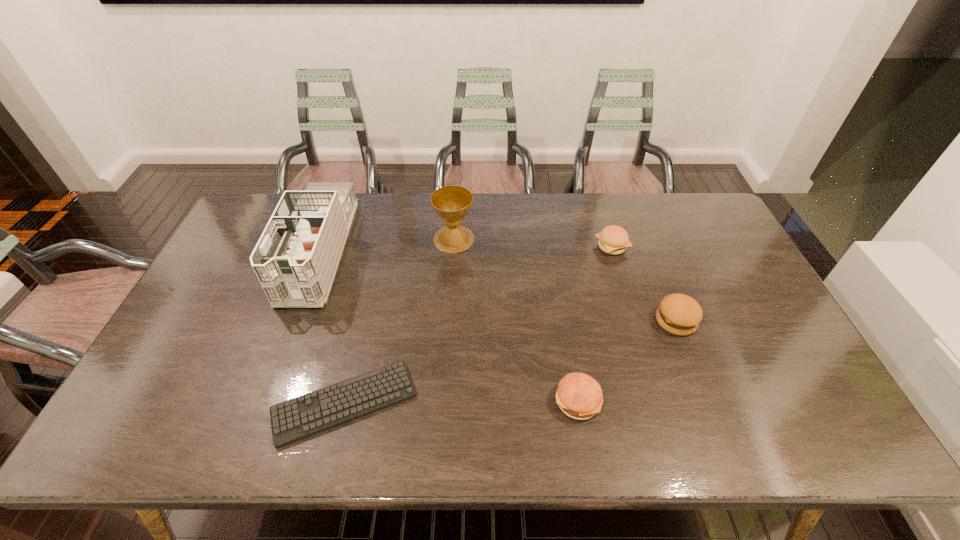
I want to click on dollhouse, so click(x=295, y=260).

The height and width of the screenshot is (540, 960). What are the coordinates of `chalice` in the screenshot? It's located at (451, 203).

This screenshot has height=540, width=960. Identify the location of the second hamburger from left to right. (614, 240).

Locate an element on the screen. This screenshot has height=540, width=960. the second object from right to left is located at coordinates (614, 240).

You are a GUI agent. You are given a task and a screenshot of the screen. Output one action in this format:
    pyautogui.click(x=<x>, y=<y>)
    Task: Click on the rightmost object
    The width and height of the screenshot is (960, 540).
    Given the screenshot: What is the action you would take?
    pyautogui.click(x=679, y=314)

This screenshot has height=540, width=960. I want to click on the rightmost hamburger, so click(x=679, y=314).

The width and height of the screenshot is (960, 540). Find the location of `the second shortest object`. the second shortest object is located at coordinates click(x=579, y=396).

Locate an element on the screen. Image resolution: width=960 pixels, height=540 pixels. the nearest hamburger is located at coordinates (579, 396).

Image resolution: width=960 pixels, height=540 pixels. I want to click on computer keyboard, so click(312, 413).

I want to click on vacant space situated 0.350m at the entrance of the dollhouse, so click(x=252, y=428).